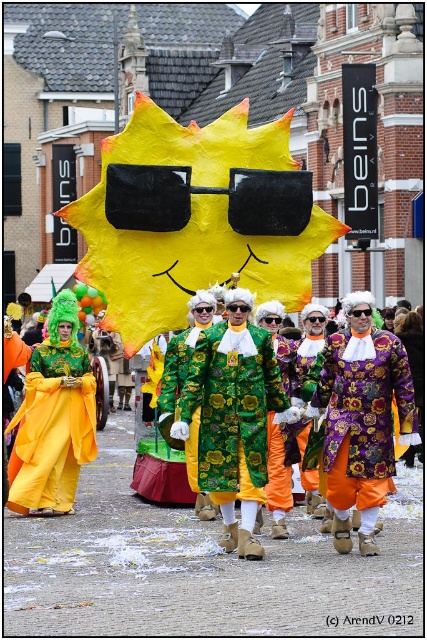
Does yellow paper/mask at center appear under green floral fabric coat at center?

No, yellow paper/mask at center is not below green floral fabric coat at center.

Is yellow paper/mask at center above green floral fabric coat at center?

Indeed, yellow paper/mask at center is positioned over green floral fabric coat at center.

Between point (155, 216) and point (215, 349), which one is positioned behind?

The point (155, 216) is behind.

Identify the location of yellow paper/mask at center. (195, 218).

Does green floral fabric coat at center appear over purple velvet coat at center?

No.

Does green floral fabric coat at center appear under purple velvet coat at center?

Indeed, green floral fabric coat at center is positioned under purple velvet coat at center.

Between point (257, 433) and point (363, 333), which one is positioned behind?

Positioned behind is point (363, 333).

Image resolution: width=427 pixels, height=640 pixels. What are the coordinates of `green floral fabric coat at center` in the screenshot? It's located at (233, 417).

Who is more forward, (246, 388) or (87, 360)?

Point (246, 388)

Who is more forward, (225, 301) or (35, 448)?

Point (225, 301)

This screenshot has height=640, width=427. I want to click on green floral fabric coat at center, so click(x=233, y=417).